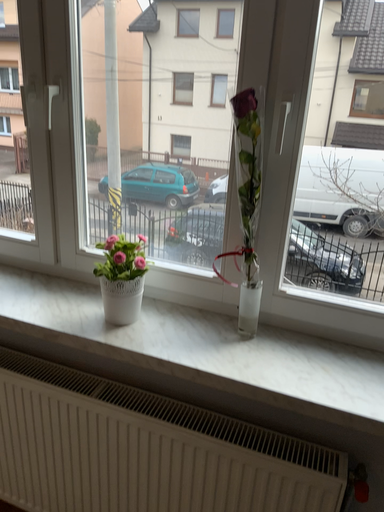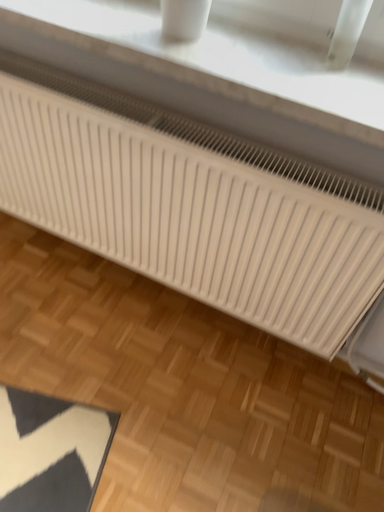
Question: Which way did the camera rotate in the video?

Choices:
 (A) rotated downward
 (B) rotated upward

Answer: (A)